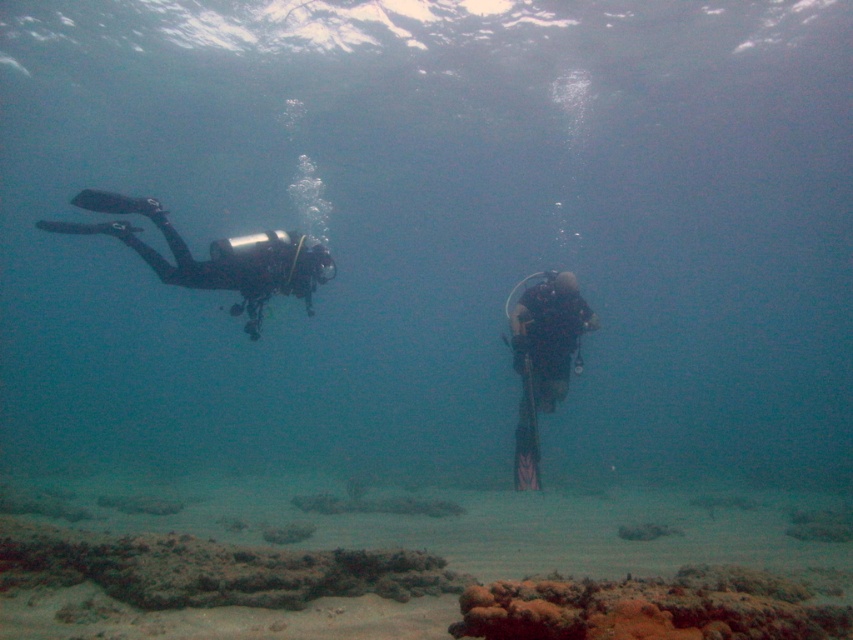
You are a scuba diver preparing to dive into the underwater scene shown. You notice a specific point marked at coordinates point (309,266). Based on your equipment, which has a maximum depth limit of 30 feet, can you safely reach that point?

The point (309,266) is 30.97 feet from the viewer, which exceeds your equipment limit of 30 feet. Therefore, you cannot safely reach that point.

Consider the image. You are a marine biologist observing two divers underwater. You notice the black matte scuba diver at left and the black matte scuba diver at center. Which diver appears bigger in size?

The black matte scuba diver at left appears bigger in size compared to the black matte scuba diver at center.

You are a marine biologist planning to place a 0.15 meter wide research buoy in the underwater scene. The buoy must be placed at the point labeled point (215, 256). Is there enough space for the buoy at that location?

The point (215, 256) is occupied by the black matte scuba diver at left. Therefore, the research buoy cannot be placed there as it would interfere with the diver.